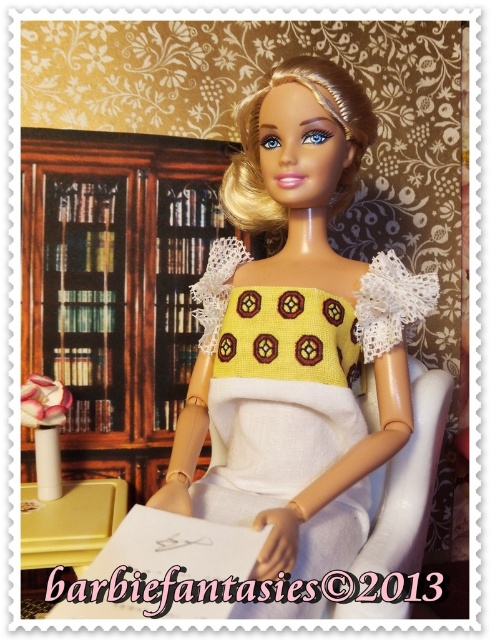
You are a photographer trying to capture the doll in the center of the image. The coordinates given are part of the doll. Which part of the doll is located at point (295, 337)?

The point (295, 337) indicates the yellow crochet dress at center.

You are organizing a small tea party in the dollhouse. The yellow crochet dress at center and the white fabric chair at center are in the way. Which object should you move to free up more space?

The yellow crochet dress at center is wider than the white fabric chair at center, so moving the yellow crochet dress at center would free up more space.